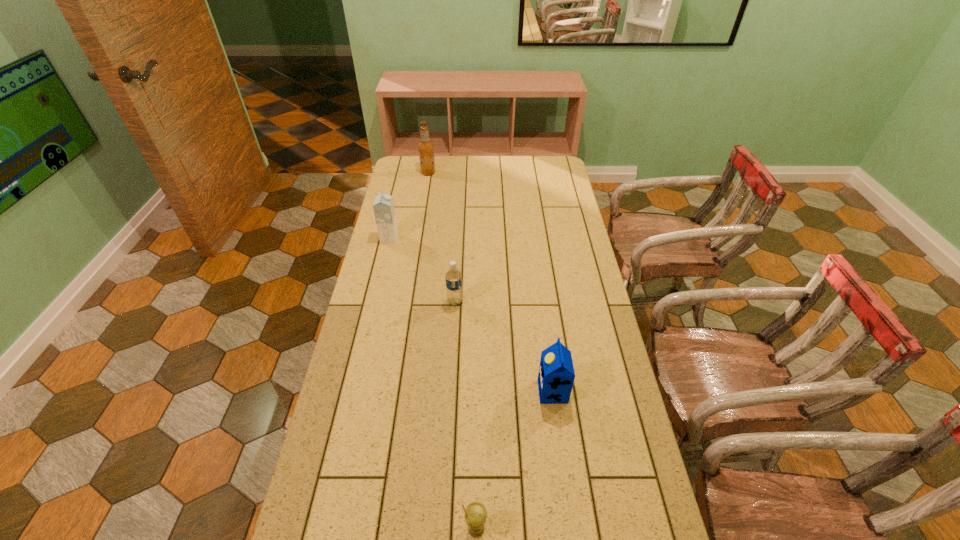
I want to click on vacant space situated 0.280m with the cap open on the fourth farthest object, so click(x=444, y=392).

The image size is (960, 540). Find the location of `blank space located 0.270m with the cap open on the fourth farthest object`. blank space located 0.270m with the cap open on the fourth farthest object is located at coordinates (446, 392).

At what (x,y) coordinates should I click in order to perform the action: click on vacant space situated 0.150m with the cap open on the fourth farthest object. Please return your answer as a coordinate pair (x, y). The width and height of the screenshot is (960, 540). Looking at the image, I should click on (488, 392).

Where is `free space located 0.190m on the left of the third farthest object`? This screenshot has width=960, height=540. free space located 0.190m on the left of the third farthest object is located at coordinates (394, 302).

Image resolution: width=960 pixels, height=540 pixels. I want to click on object located in the far edge section of the desktop, so click(x=426, y=149).

This screenshot has width=960, height=540. I want to click on beer bottle situated at the left edge, so click(426, 149).

Find the location of a particular element. The height and width of the screenshot is (540, 960). carton positioned at the left edge is located at coordinates (383, 206).

The height and width of the screenshot is (540, 960). I want to click on object located at the far left corner, so click(x=426, y=149).

Locate an element on the screen. vacant region at the far edge of the desktop is located at coordinates (444, 162).

You are a GUI agent. You are given a task and a screenshot of the screen. Output one action in this format:
    pyautogui.click(x=<x>, y=<y>)
    Task: Click on the vacant space at the left edge
    The width and height of the screenshot is (960, 540).
    Given the screenshot: What is the action you would take?
    pyautogui.click(x=418, y=228)